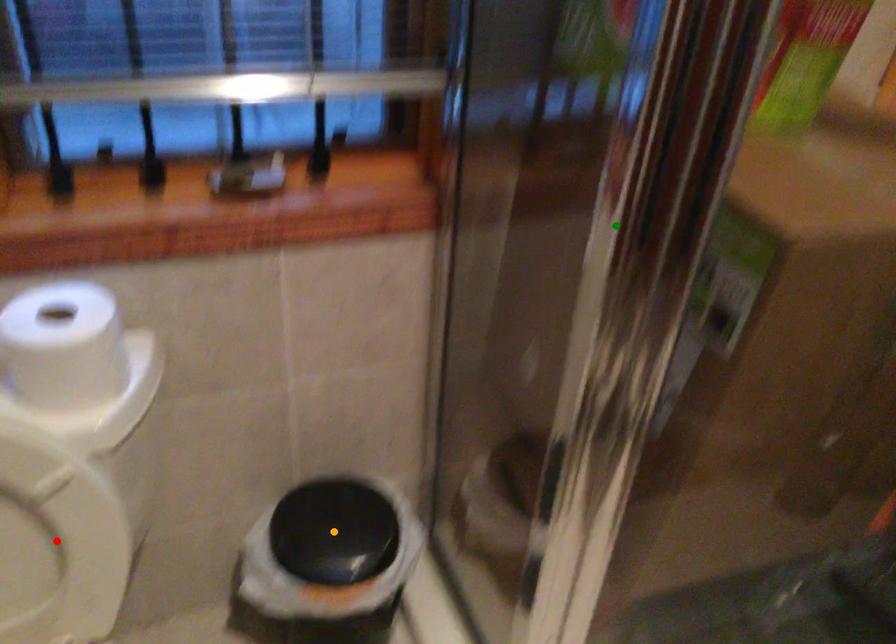
Order these from farthest to nearest:
- orange point
- green point
- red point

orange point, red point, green point